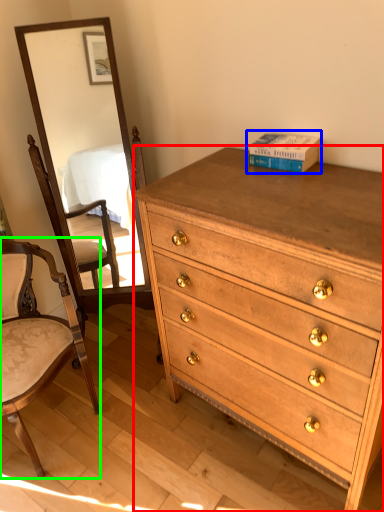
Question: Which object is positioned closest to chest of drawers (highlighted by a red box)? Select from book (highlighted by a blue box) and chair (highlighted by a green box).

Choices:
 (A) book
 (B) chair

Answer: (A)